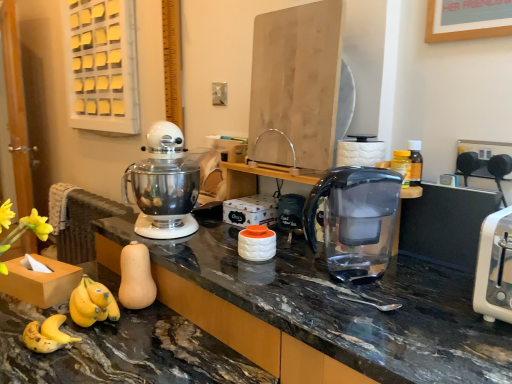
Where is `vacant area that lies to the right of transparent plastic water filter pitcher at center`? The image size is (512, 384). vacant area that lies to the right of transparent plastic water filter pitcher at center is located at coordinates (417, 278).